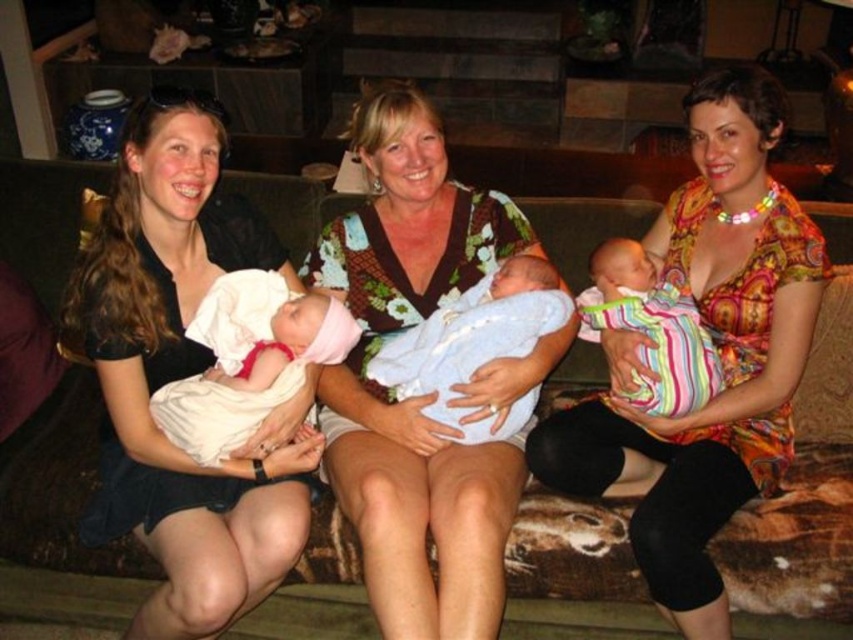
Question: Is matte black dress at left to the right of striped cotton baby at center from the viewer's perspective?

Choices:
 (A) no
 (B) yes

Answer: (A)

Question: Which point is farther to the camera?

Choices:
 (A) light blue fabric swaddle at center
 (B) striped cotton baby at center
 (C) matte black dress at left

Answer: (B)

Question: Does matte floral dress at center have a larger size compared to light blue fabric swaddle at center?

Choices:
 (A) no
 (B) yes

Answer: (B)

Question: Considering the real-world distances, which object is closest to the matte floral dress at center?

Choices:
 (A) striped cotton baby at center
 (B) matte black dress at left

Answer: (A)

Question: Can you confirm if matte black dress at left is wider than matte floral dress at center?

Choices:
 (A) yes
 (B) no

Answer: (A)

Question: Among these objects, which one is nearest to the camera?

Choices:
 (A) matte black dress at left
 (B) floral fabric baby at center

Answer: (B)